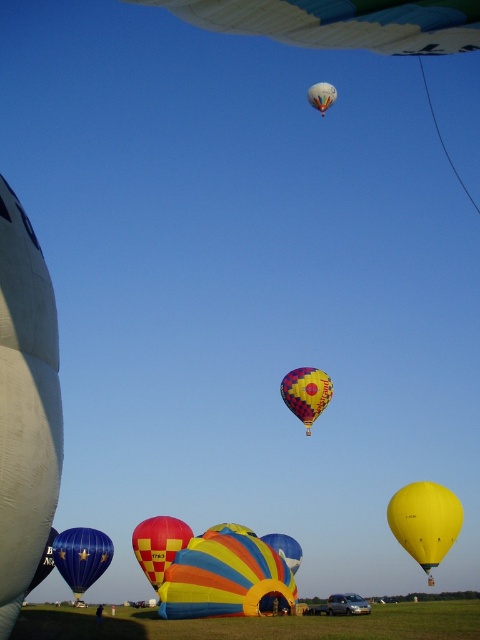
Question: Considering the real-world distances, which object is closest to the rainbow striped balloon at center?

Choices:
 (A) yellow fabric balloon at lower center
 (B) multicolored fabric balloon at center
 (C) blue glossy balloon at lower left

Answer: (A)

Question: Is checkered fabric balloon at lower center closer to the viewer compared to multicolored fabric hot air balloon at upper center?

Choices:
 (A) yes
 (B) no

Answer: (A)

Question: Considering the real-world distances, which object is farthest from the rainbow striped balloon at center?

Choices:
 (A) yellow fabric balloon at lower center
 (B) checkered fabric balloon at lower center
 (C) multicolored fabric balloon at center

Answer: (C)

Question: Among these points, which one is nearest to the camera?

Choices:
 (A) (316, 108)
 (B) (436, 497)
 (C) (288, 556)

Answer: (B)

Question: Where is multicolored striped balloon at center located in relation to multicolored fabric balloon at lower left in the image?

Choices:
 (A) right
 (B) left

Answer: (A)

Question: Does rainbow striped balloon at center have a greater width compared to yellow matte balloon at lower right?

Choices:
 (A) no
 (B) yes

Answer: (B)